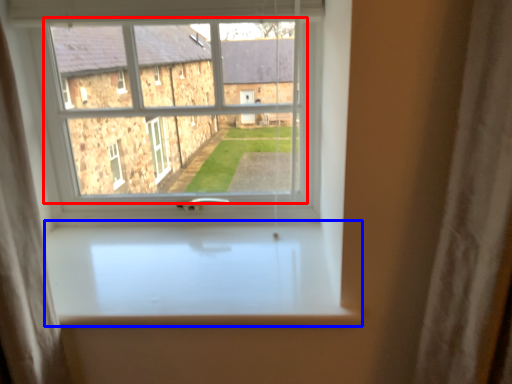
Question: Which of the following is the farthest to the observer, bay window (highlighted by a red box) or window sill (highlighted by a blue box)?

Choices:
 (A) bay window
 (B) window sill

Answer: (A)